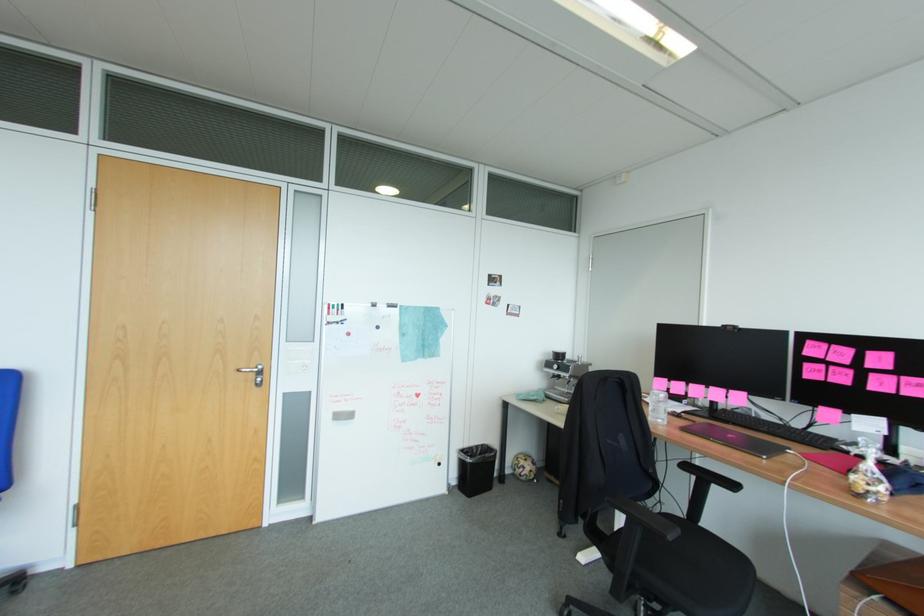
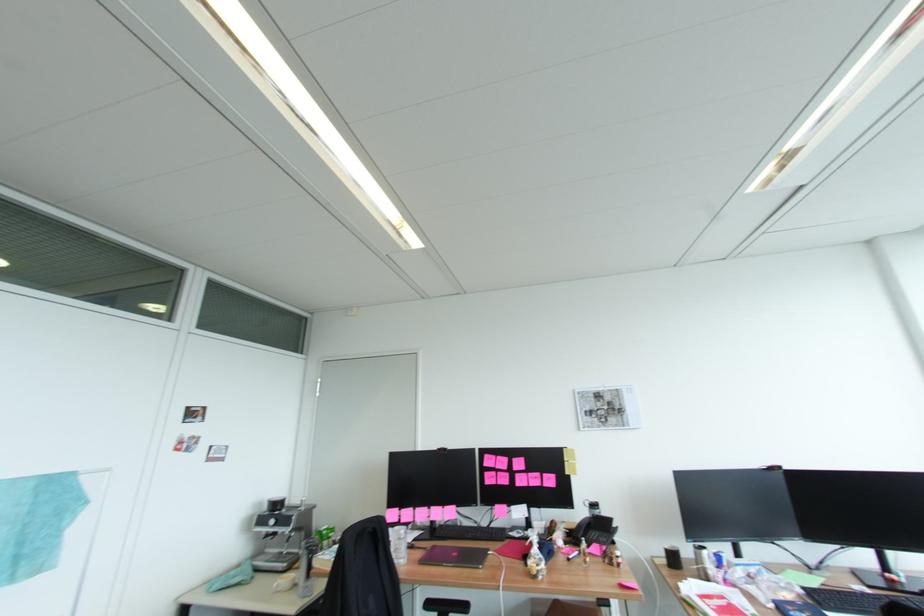
The point at (689, 430) is marked in the first image. Where is the corresponding point in the second image?

(428, 562)